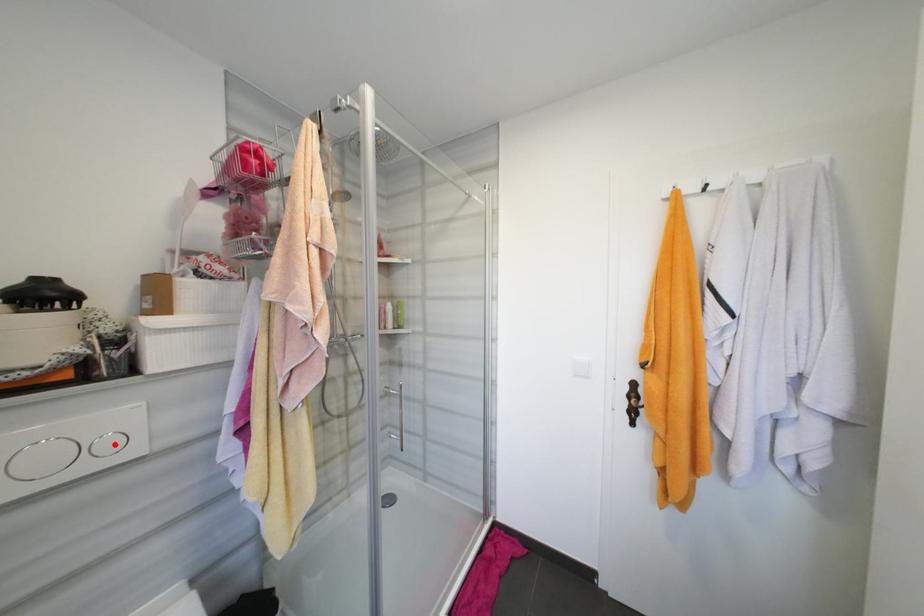
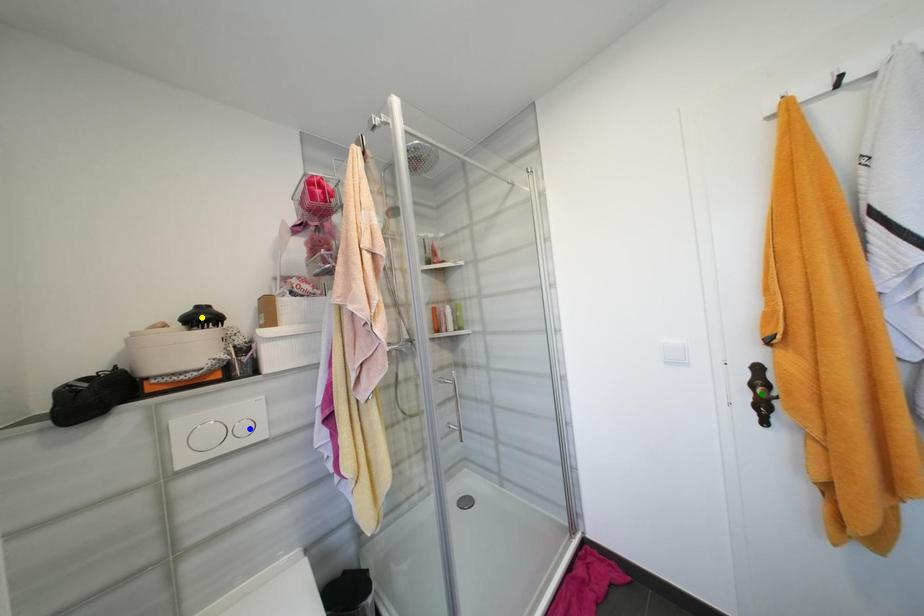
Question: I am providing you with two images of the same scene from different viewpoints. A red point is marked on the first image. You are given multiple points on the second image. Which point in image 2 is actually the same real-world point as the red point in image 1?

Choices:
 (A) blue point
 (B) yellow point
 (C) green point

Answer: (A)